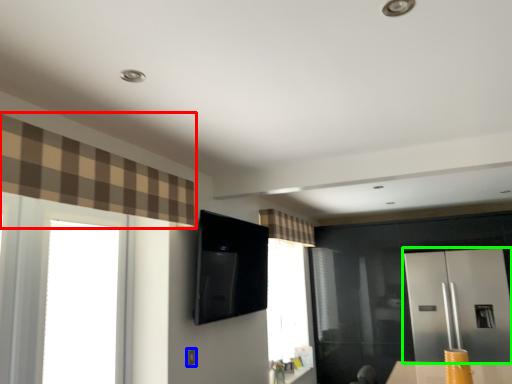
Question: Considering the real-world distances, which object is closest to curtain (highlighted by a red box)? electric outlet (highlighted by a blue box) or screen door (highlighted by a green box).

Choices:
 (A) electric outlet
 (B) screen door

Answer: (A)